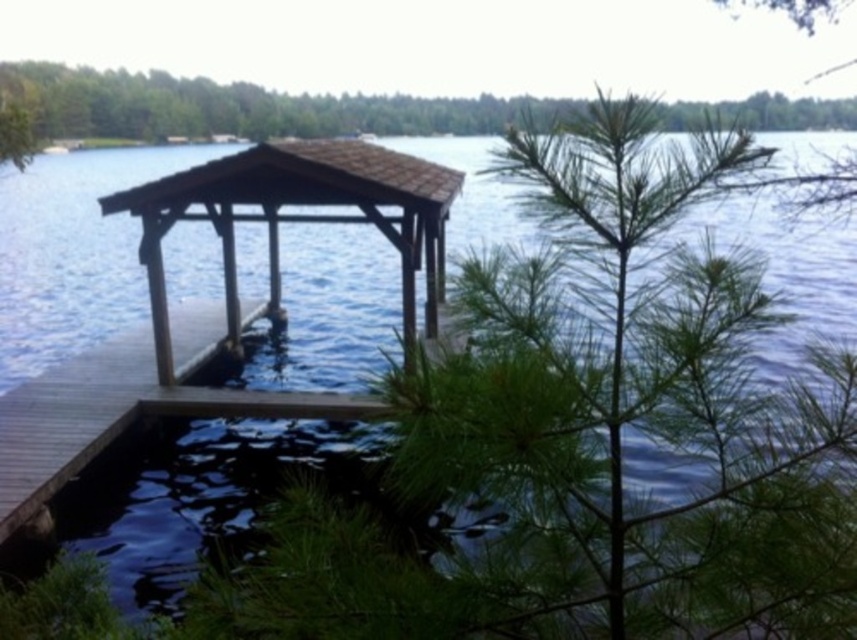
You are standing on the brown wooden dock at lower left and want to reach the brown wooden gazebo at center. Which direction should you move to get there?

The brown wooden gazebo at center is located above the brown wooden dock at lower left, so you should move upward to reach it.